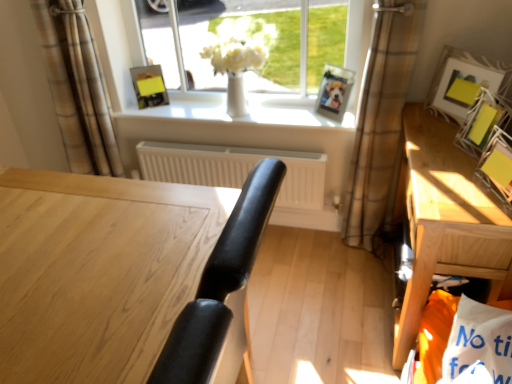
Identify the location of vacant space situated above white glossy window sill at center (from a real-world perspective). This screenshot has width=512, height=384. (246, 113).